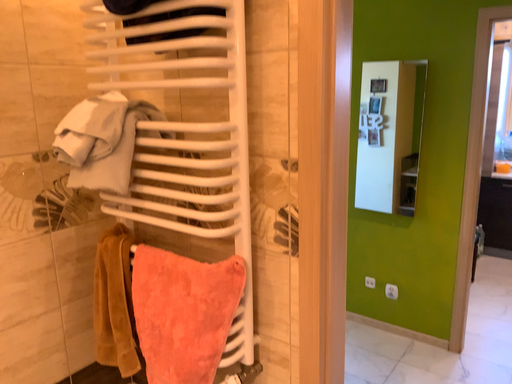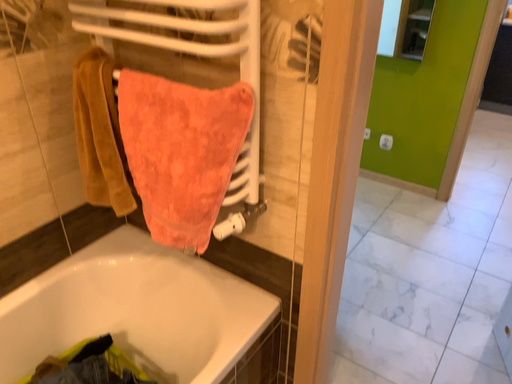
Question: Which way did the camera rotate in the video?

Choices:
 (A) rotated downward
 (B) rotated upward

Answer: (A)